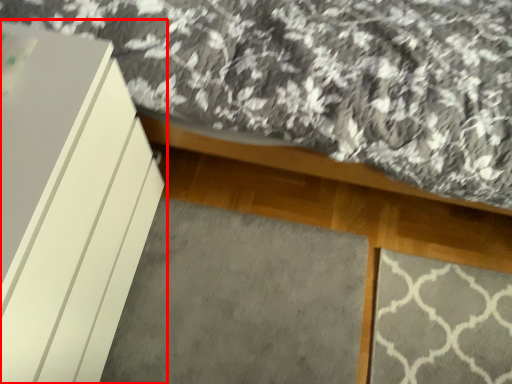
Question: From the image's perspective, considering the relative positions of furniture (annotated by the red box) and mat in the image provided, where is furniture (annotated by the red box) located with respect to the staircase?

Choices:
 (A) above
 (B) below

Answer: (A)